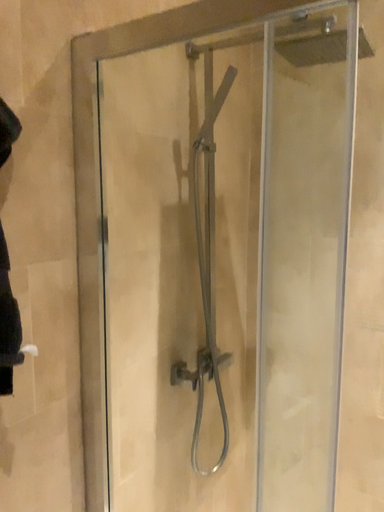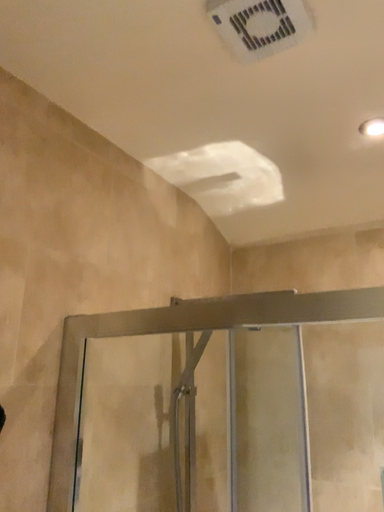
Question: Which way did the camera rotate in the video?

Choices:
 (A) rotated upward
 (B) rotated downward

Answer: (A)